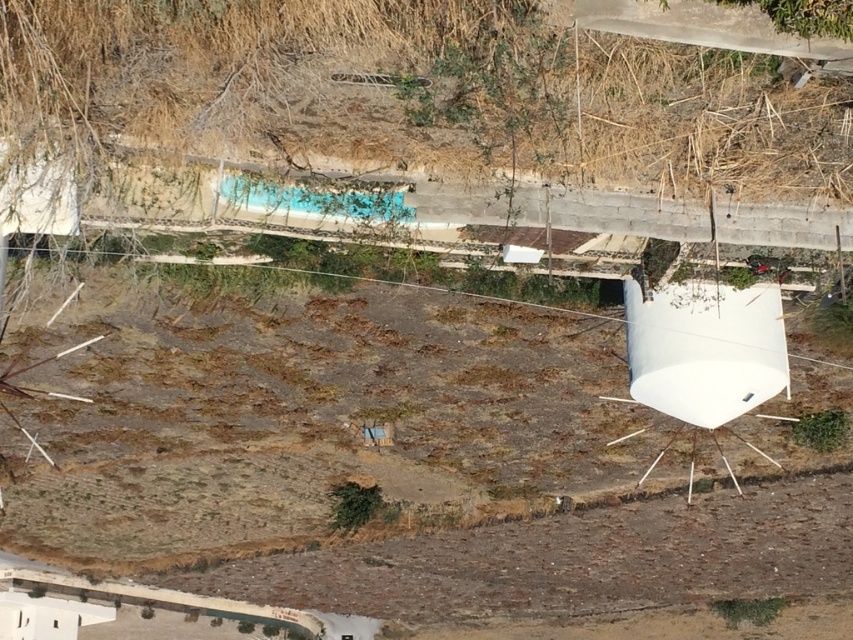
You are a farmer standing at the point marked as point (398,467). What is the name of the object you are standing on?

The brown soil at center is located at point (398,467), so you are standing on the brown soil at center.